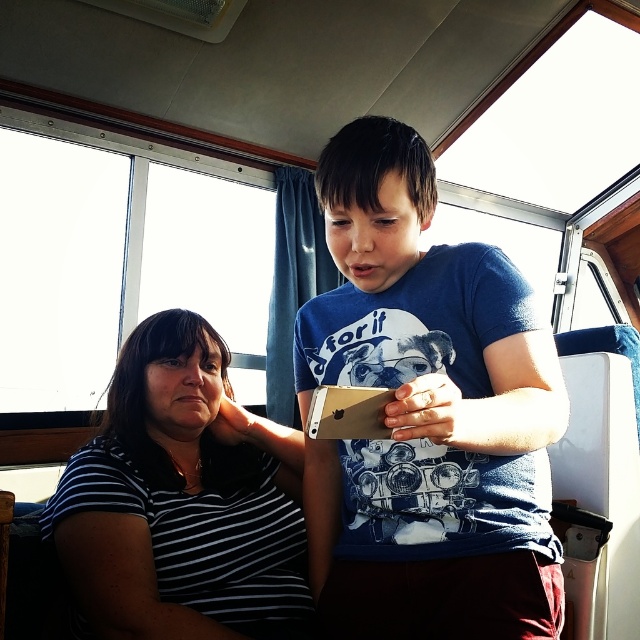
You are a photographer trying to capture the best shot of both the blue cotton shirt at center and the black striped shirt at left. Since you want both subjects to be in focus, you need to adjust your camera settings. Considering their positions, which shirt should you focus on to ensure both are sharp?

You should focus on the blue cotton shirt at center because it is closer to the viewer than the black striped shirt at left. By focusing on the closer subject, the depth of field will naturally include the farther one, ensuring both are in focus.

You are a tailor measuring the distance between two shirts in a boat cabin. The blue cotton shirt at center and the black striped shirt at left need to be placed on a shelf that can only accommodate items spaced 35 centimeters apart. Can both shirts fit on the shelf without exceeding the space?

The distance between the blue cotton shirt at center and the black striped shirt at left is 36.92 centimeters, which exceeds the shelf spacing limit of 35 centimeters. Therefore, the shirts cannot both fit on the shelf without exceeding the space.

You are a passenger on a boat and need to choose between two shirts to wear for a photo. The blue cotton shirt at center and the black striped shirt at left are available. Based on their positions in the image, which shirt is more likely to be easily accessible to you?

The blue cotton shirt at center is positioned over the black striped shirt at left, so it is more likely to be easily accessible as it is placed in a more central and visible location.